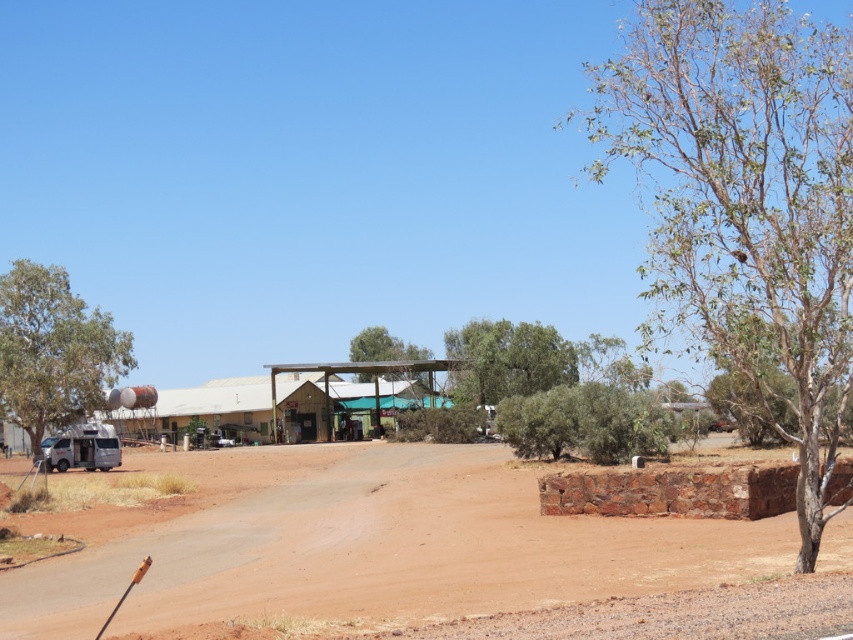
Looking at this image, can you confirm if brown textured tree at right is positioned below brown dirt field at lower left?

No, brown textured tree at right is not below brown dirt field at lower left.

Who is more forward, (747,208) or (178,572)?

Positioned in front is point (747,208).

Find the location of a particular element. brown textured tree at right is located at coordinates 747,205.

Measure the distance between brown dirt field at lower left and green leafy tree at left.

brown dirt field at lower left is 93.58 feet away from green leafy tree at left.

Measure the distance between point (380, 579) and camera.

Point (380, 579) and camera are 46.14 feet apart from each other.

Where is `brown dirt field at lower left`? The image size is (853, 640). brown dirt field at lower left is located at coordinates (384, 552).

Does brown textured tree at right have a greater width compared to green leafy tree at left?

Yes, brown textured tree at right is wider than green leafy tree at left.

Does brown textured tree at right have a lesser width compared to green leafy tree at left?

No.

Between point (776, 8) and point (21, 320), which one is positioned in front?

Point (776, 8) is in front.

Locate an element on the screen. brown textured tree at right is located at coordinates (747, 205).